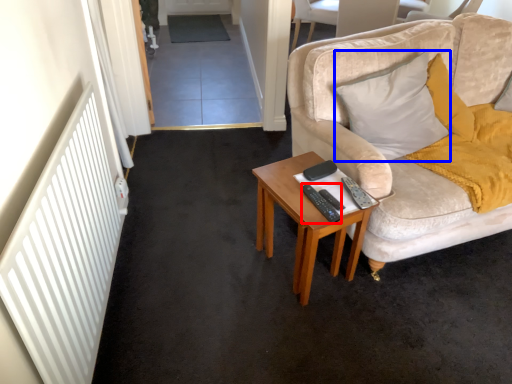
Question: Which point is closer to the camera, remote control (highlighted by a red box) or pillow (highlighted by a blue box)?

Choices:
 (A) remote control
 (B) pillow

Answer: (A)